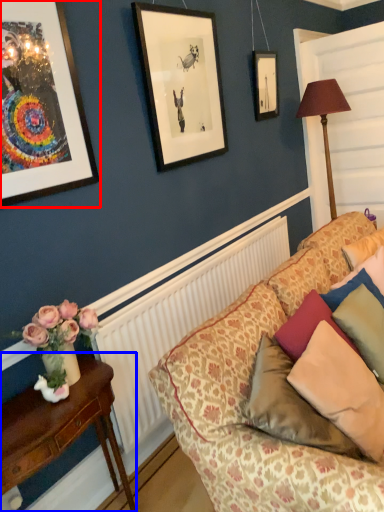
Question: Among these objects, which one is farthest to the camera, picture frame (highlighted by a red box) or table (highlighted by a blue box)?

Choices:
 (A) picture frame
 (B) table

Answer: (A)